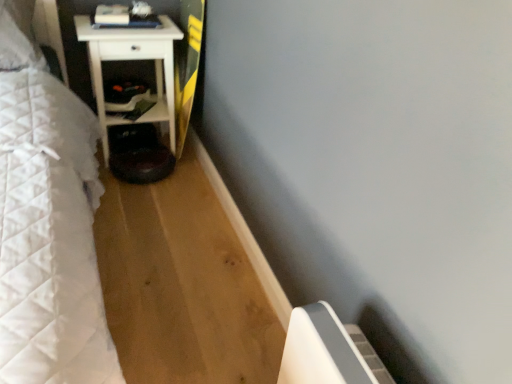
I want to click on vacant space underneath yellow-green wood longboard at center (from a real-world perspective), so click(192, 153).